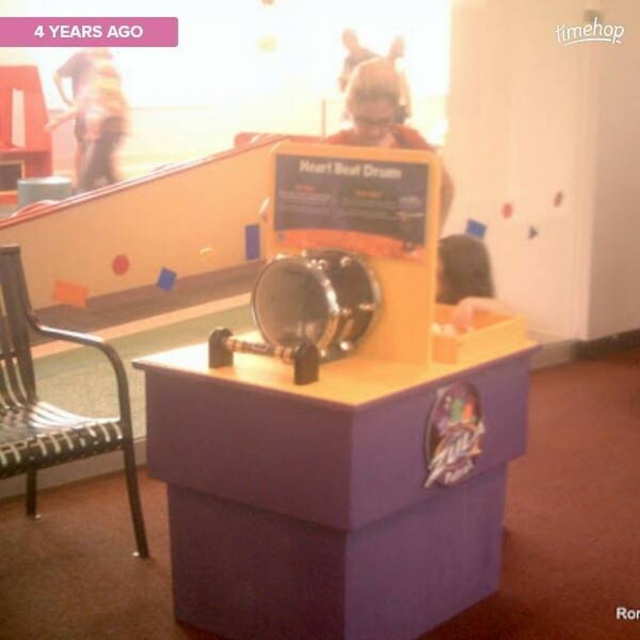
You are setting up a small table and chair set in a playroom. You have a purple wood table at center and a metallic woven chair at left. Which one should you place first if you want to ensure there is enough space for both?

You should place the purple wood table at center first because its width is larger than the metallic woven chair at left, so positioning it first ensures there is enough space left for the chair.

You are at a children play area and want to sit on the metallic woven chair at left. From the purple wood table at center, which direction should you move to reach it?

The purple wood table at center is to the right of the metallic woven chair at left, so you should move to the left to reach the metallic woven chair at left.

You are a visitor in the play area and want to sit down. You see the purple wood table at center and the metallic woven chair at left. Which object should you approach first if you want to sit?

The metallic woven chair at left should be approached first because the purple wood table at center is located below it, meaning the chair is positioned higher up or closer to your current viewpoint.